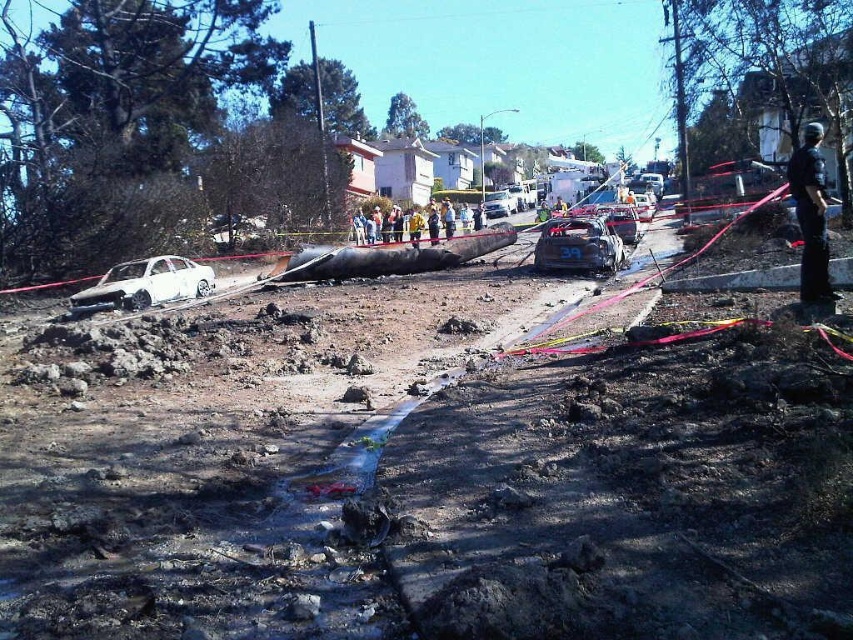
You are a rescue worker trying to reach the yellow fabric person at center. There is a white matte car at left blocking your path. Can you go around it on the right side?

The white matte car at left is to the left of yellow fabric person at center, so you can go around it on the right side to reach the yellow fabric person at center.

You are a rescue worker assessing the scene. You need to determine if the white matte car at left can be lifted over the yellow fabric person at center using a crane. Can it be done based on their sizes?

The white matte car at left is shorter than the yellow fabric person at center, so it is possible to lift the white matte car at left over the yellow fabric person at center using a crane since the car is smaller in height.